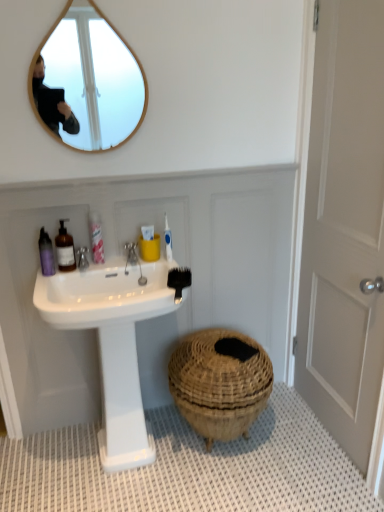
You are a GUI agent. You are given a task and a screenshot of the screen. Output one action in this format:
    pyautogui.click(x=<x>, y=<y>)
    Task: Click on the vacant area that lies in front of matte purple bottle at upper left, which is the 3th toiletry from right to left
    
    Given the screenshot: What is the action you would take?
    pyautogui.click(x=46, y=284)